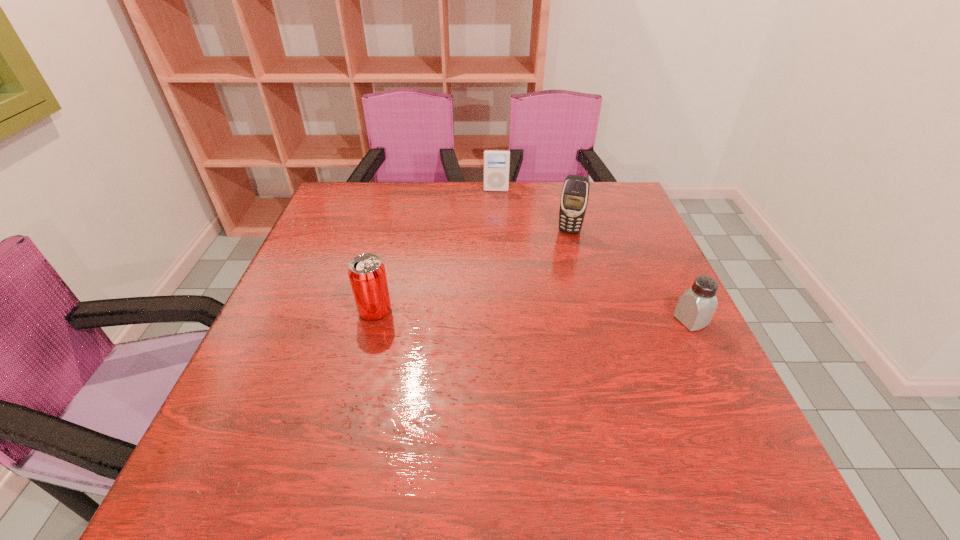
The image size is (960, 540). Find the location of `the leftmost object`. the leftmost object is located at coordinates (367, 275).

Find the location of a particular element. the shortest object is located at coordinates (696, 306).

This screenshot has height=540, width=960. Find the location of `saltshaker`. saltshaker is located at coordinates (696, 306).

Image resolution: width=960 pixels, height=540 pixels. Find the location of `the third nearest object`. the third nearest object is located at coordinates (575, 193).

This screenshot has height=540, width=960. Identify the location of cellular telephone. (575, 193).

Where is `the third object from right to left`? This screenshot has width=960, height=540. the third object from right to left is located at coordinates (496, 162).

This screenshot has width=960, height=540. I want to click on the farthest object, so click(x=496, y=162).

In order to click on vacant area situated on the front of the soda can in this screenshot , I will do point(366,348).

Locate an element on the screen. The width and height of the screenshot is (960, 540). vacant region located on the front of the saltshaker is located at coordinates (740, 421).

At what (x,y) coordinates should I click in order to perform the action: click on vacant region located 0.400m on the front face of the second object from right to left. Please return your answer as a coordinate pair (x, y). The image size is (960, 540). Looking at the image, I should click on (540, 342).